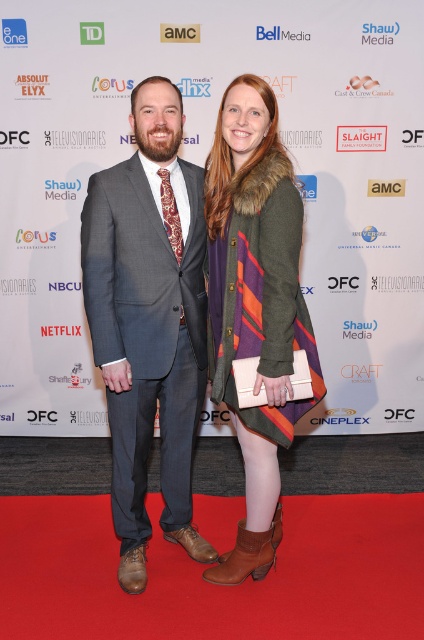
You are at a media event and need to locate the point marked as coordinates point (148,321). According to the scene, where exactly is this point located?

The point (148,321) is located on the gray textured suit at center.

You are a photographer at a formal event who needs to capture a group photo of the two individuals. The camera you are using has a focus range of 10 inches. Can you capture both the gray textured suit at center and the striped wool coat at center in focus without adjusting your position?

The distance between the gray textured suit at center and the striped wool coat at center is 9.78 inches, which is within the camera focus range of 10 inches. Therefore, you can capture both in focus without moving.

You are standing at point [117,413] and want to take a photo of the two people at the event. The camera you have can focus on subjects within 2 meters. Will the camera be able to focus on them?

The distance between point [117,413] and the camera is 2.08 meters, which is slightly beyond the camera focus range of 2 meters. Therefore, the camera may not be able to focus on them properly.